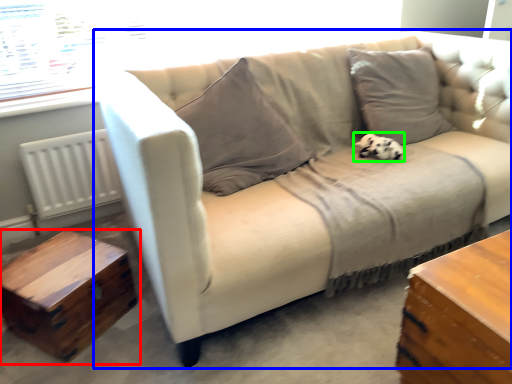
Question: Estimate the real-world distances between objects in this image. Which object is closer to table (highlighted by a red box), studio couch (highlighted by a blue box) or animal (highlighted by a green box)?

Choices:
 (A) studio couch
 (B) animal

Answer: (A)